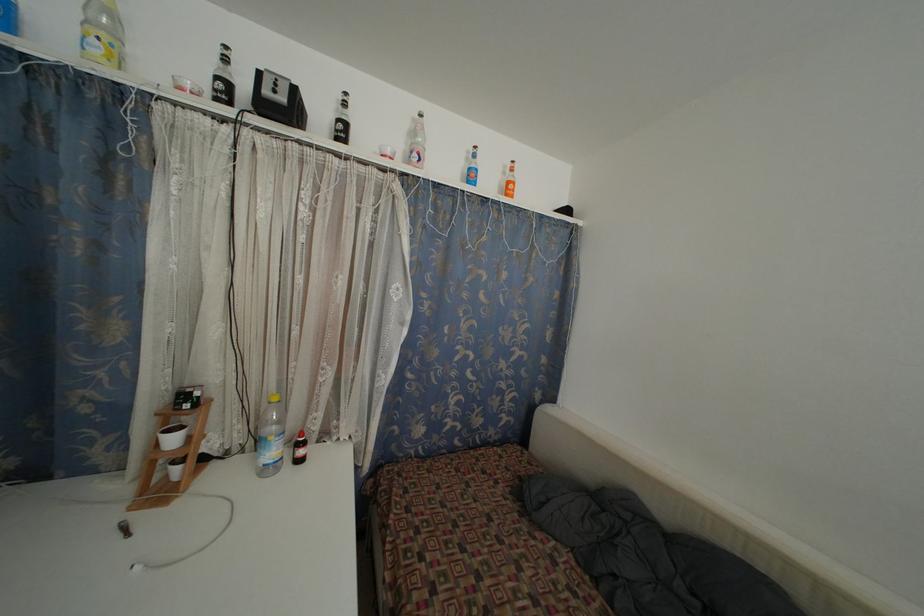
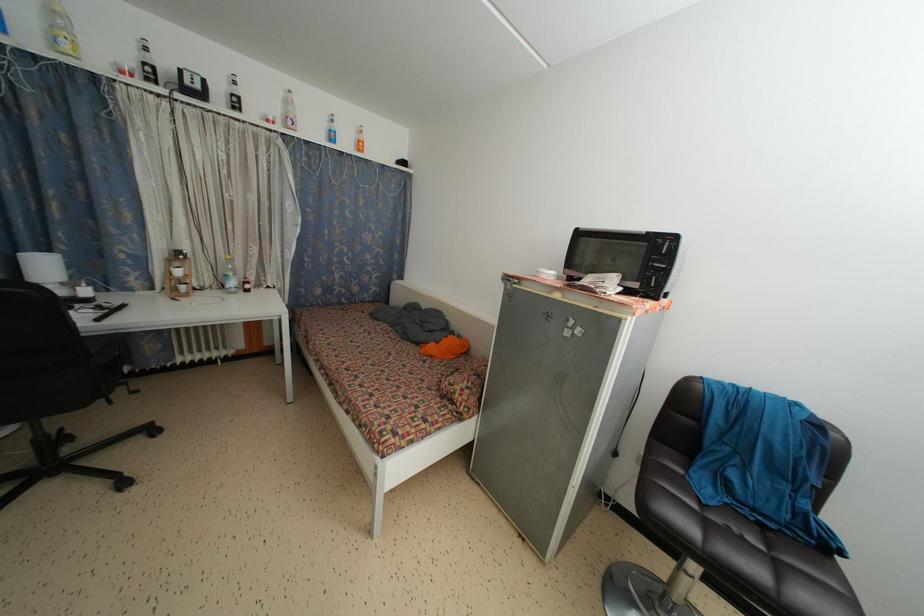
In the second image, find the point that corresponds to point 513,188 in the first image.

(362, 147)